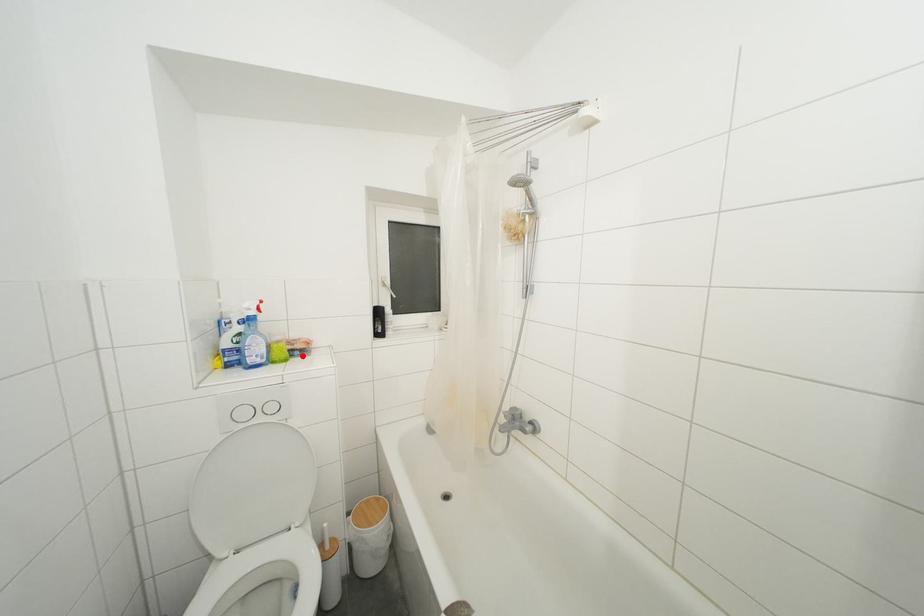
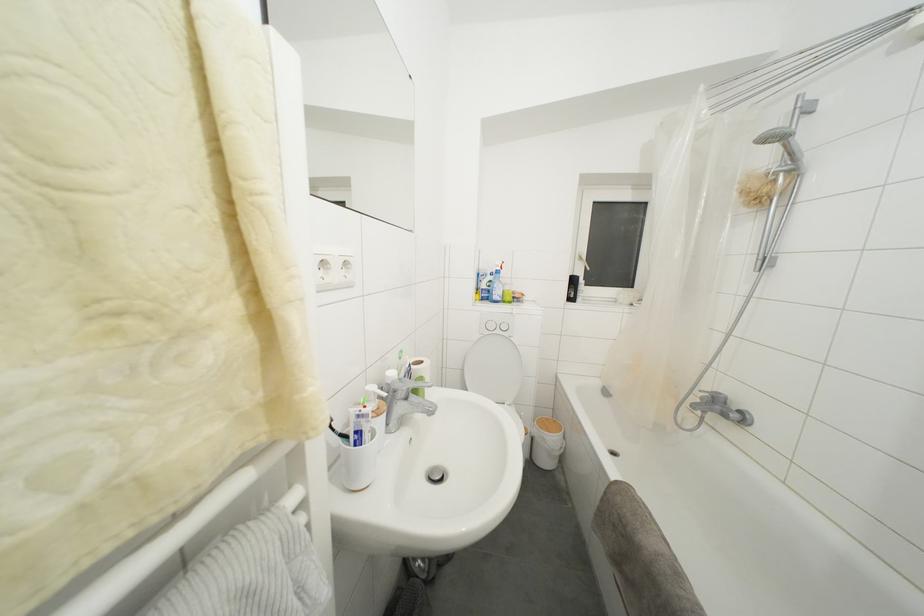
The point at the highlighted location is marked in the first image. Where is the corresponding point in the second image?

(520, 304)